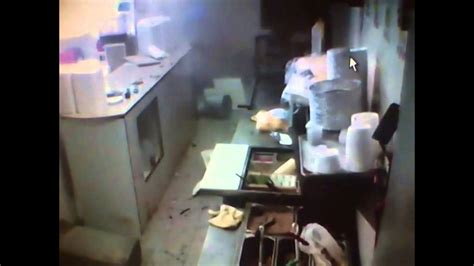
You are a GUI agent. You are given a task and a screenshot of the screen. Output one action in this format:
    pyautogui.click(x=<x>, y=<y>)
    Task: Click on the box
    This screenshot has width=474, height=266.
    Given the screenshot: What is the action you would take?
    pyautogui.click(x=87, y=98)